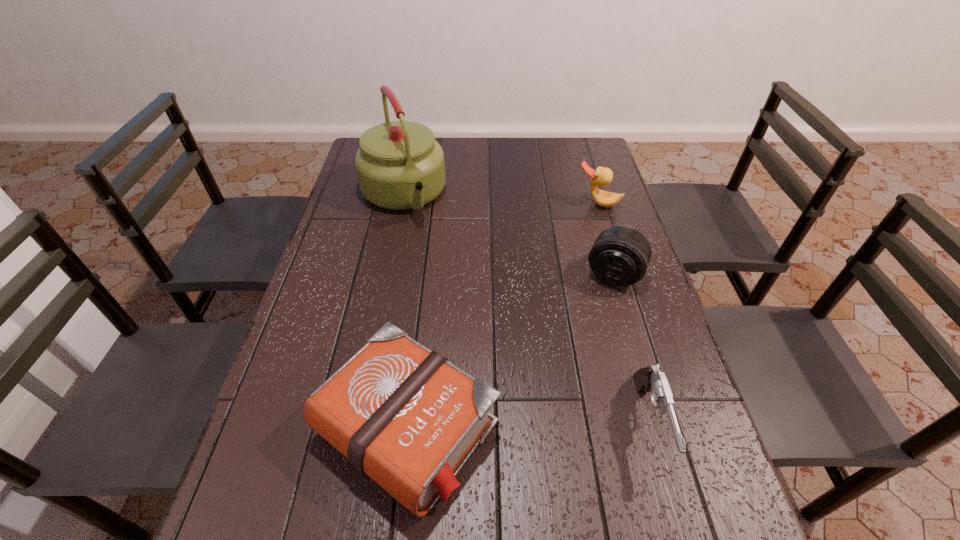
Locate an element on the screen. free space located 0.260m on the front-facing side of the telephoto lens is located at coordinates (570, 368).

Image resolution: width=960 pixels, height=540 pixels. I want to click on free region located 0.190m on the front-facing side of the telephoto lens, so click(x=581, y=345).

The image size is (960, 540). In order to click on vacant space located 0.250m on the beak of the duck in this screenshot , I will do `click(567, 260)`.

The image size is (960, 540). I want to click on vacant space located on the beak of the duck, so click(554, 289).

Where is `vacant region located 0.400m on the beak of the duck`? This screenshot has height=540, width=960. vacant region located 0.400m on the beak of the duck is located at coordinates (551, 296).

The width and height of the screenshot is (960, 540). Identify the location of object present at the far edge. (400, 166).

This screenshot has height=540, width=960. In order to click on Bible situated at the near edge in this screenshot , I will do `click(405, 416)`.

Image resolution: width=960 pixels, height=540 pixels. Identify the location of gun present at the near edge. (650, 379).

Locate an element on the screen. Bible that is positioned at the left edge is located at coordinates (405, 416).

The height and width of the screenshot is (540, 960). Identify the location of kettle present at the left edge. coord(400,166).